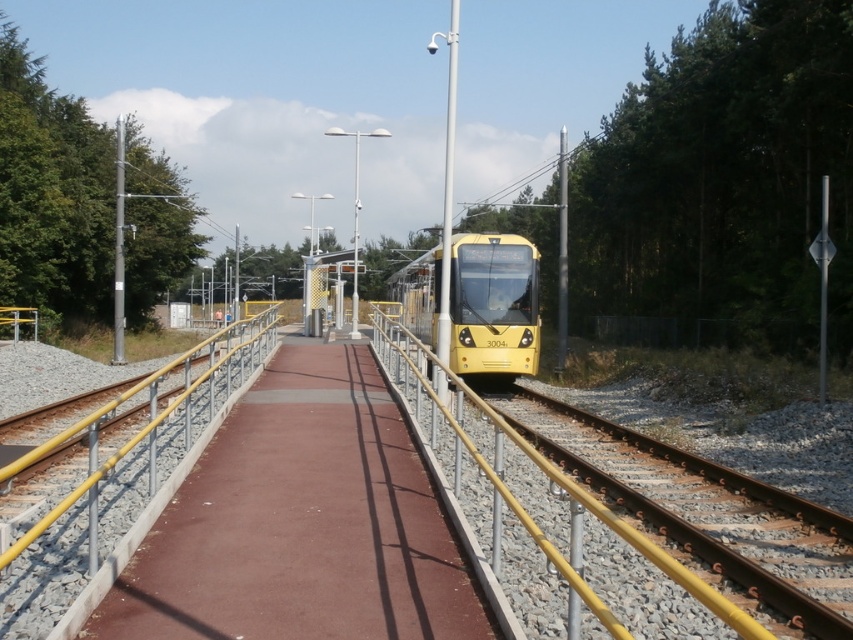
Between yellow metallic track at center and yellow metallic rail at left, which one appears on the right side from the viewer's perspective?

yellow metallic track at center is more to the right.

Does yellow metallic track at center appear on the left side of yellow metallic rail at left?

In fact, yellow metallic track at center is to the right of yellow metallic rail at left.

Is point (583, 506) farther from viewer compared to point (117, 508)?

That is False.

Where is `yellow metallic track at center`? This screenshot has width=853, height=640. yellow metallic track at center is located at coordinates (614, 518).

Can you confirm if green leafy tree at left is thinner than yellow matte train at center?

No.

Locate an element on the screen. green leafy tree at left is located at coordinates (51, 193).

Where is `green leafy tree at left`? Image resolution: width=853 pixels, height=640 pixels. green leafy tree at left is located at coordinates pos(51,193).

Does yellow metallic track at center have a smaller size compared to green leafy tree at left?

Indeed, yellow metallic track at center has a smaller size compared to green leafy tree at left.

Is point (602, 525) closer to viewer compared to point (0, 243)?

Yes, it is in front of point (0, 243).

Which is in front, point (653, 476) or point (126, 168)?

Point (653, 476) is in front.

Locate an element on the screen. This screenshot has width=853, height=640. yellow metallic track at center is located at coordinates (614, 518).